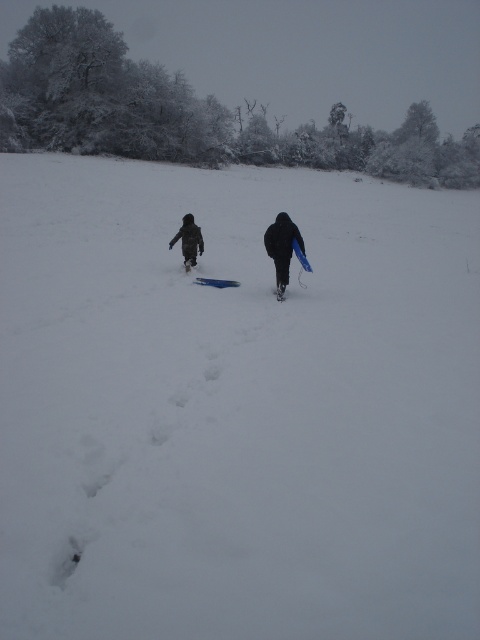
You are trying to locate the dark blue plastic sled at center in the snowy landscape. According to the coordinates provided, where exactly is it positioned?

The dark blue plastic sled at center is located at point 0.383 along the horizontal axis and 0.590 along the vertical axis in the image.

You are planning to take a photo of the two children wearing the black matte jacket at center and dark gray fabric jacket at center in the snowy landscape. Which jacket takes up less space in the photo?

The black matte jacket at center occupies less space than the dark gray fabric jacket at center, so the black matte jacket at center takes up less space in the photo.